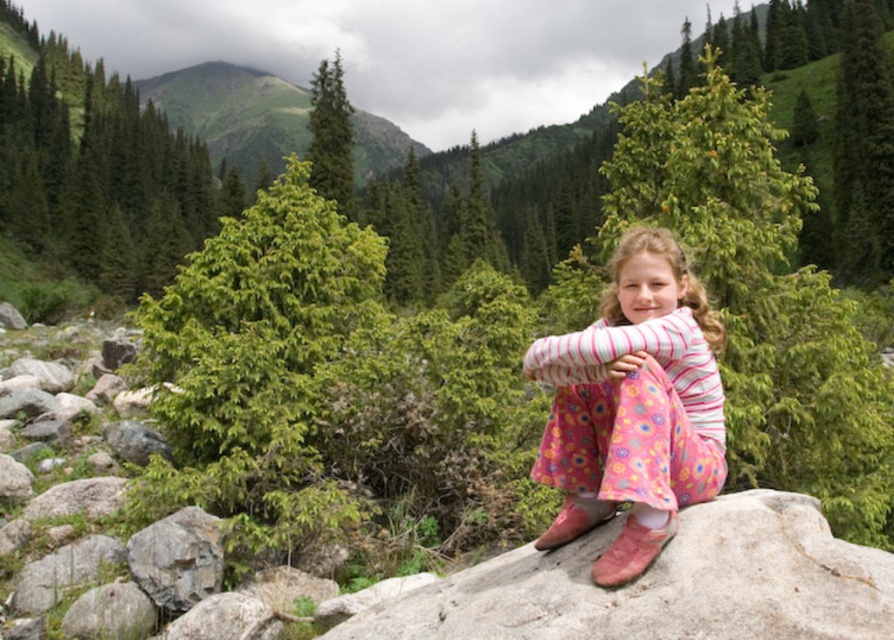
Question: Considering the real-world distances, which object is farthest from the pink floral dress at center?

Choices:
 (A) pink fabric at center
 (B) green grassy mountain at upper center
 (C) pink suede boot at lower center
 (D) green matte pine at upper left

Answer: (B)

Question: Can you confirm if green matte pine at upper left is positioned to the right of pink suede boot at lower center?

Choices:
 (A) yes
 (B) no

Answer: (B)

Question: Which point is farther from the camera taking this photo?

Choices:
 (A) (330, 186)
 (B) (555, 536)
 (C) (625, 529)
 (D) (392, 128)

Answer: (D)

Question: Can you confirm if pink floral dress at center is smaller than green grassy mountain at upper center?

Choices:
 (A) no
 (B) yes

Answer: (B)

Question: Which of the following is the closest to the observer?

Choices:
 (A) matte brown boot at lower center
 (B) pink suede boot at lower center

Answer: (B)

Question: Can you confirm if pink floral dress at center is smaller than matte brown boot at lower center?

Choices:
 (A) no
 (B) yes

Answer: (A)